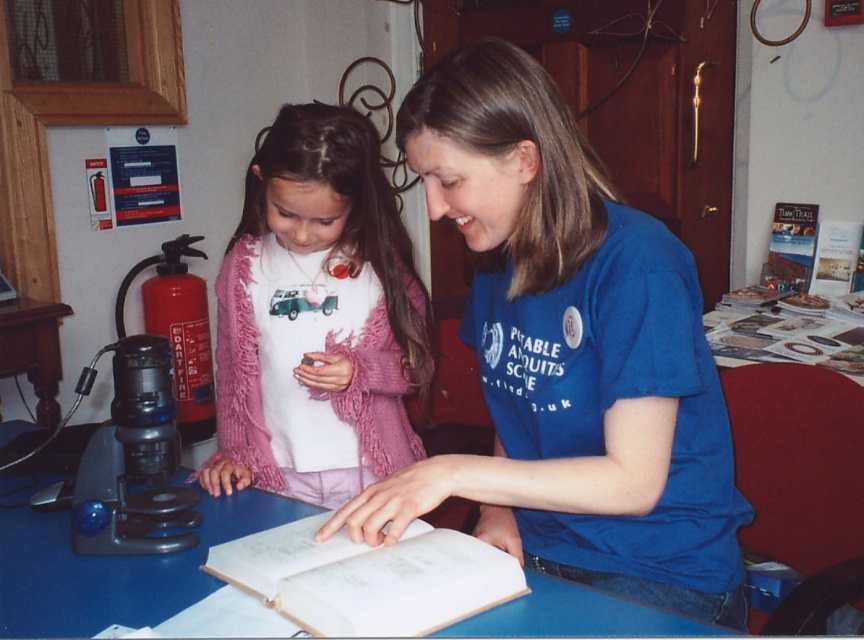
You are a visitor at this location and want to place a new book on the wooden table at lower left. Based on the scene, where exactly should you place the new book relative to the white paper book at center?

The white paper book at center is to the right of the wooden table at lower left, so you should place the new book to the left side of the white paper book at center to align it with the wooden table at lower left.

You are a visitor at the library and want to place a new book on the blue plastic table at center. Can you place the book directly in front of you on the table without moving the white paper book at center?

The blue plastic table at center is further to the viewer than the white paper book at center, so the book can be placed directly in front of you on the table without moving the white paper book at center because the table extends beyond the book towards the viewer.